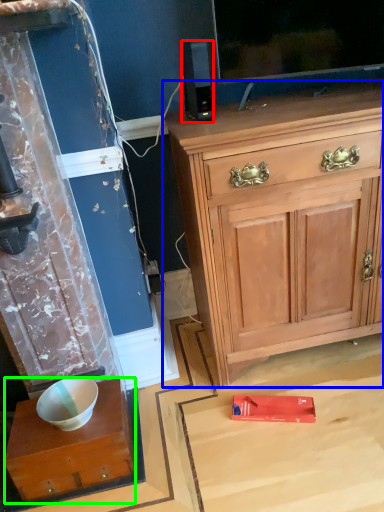
Question: Estimate the real-world distances between objects in this image. Which object is closer to loudspeaker (highlighted by a red box), cabinetry (highlighted by a blue box) or desk (highlighted by a green box)?

Choices:
 (A) cabinetry
 (B) desk

Answer: (A)